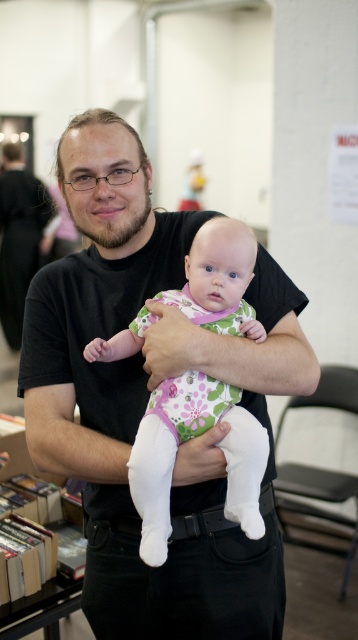
Question: Which of the following is the closest to the observer?

Choices:
 (A) (45, 531)
 (B) (220, 541)

Answer: (B)

Question: Which of these objects is positioned farthest from the floral cotton onesie at center?

Choices:
 (A) hardcover books at left
 (B) black matte shirt at center

Answer: (A)

Question: Which object is closer to the camera taking this photo?

Choices:
 (A) hardcover books at left
 (B) black matte shirt at center

Answer: (B)

Question: Is floral cotton onesie at center thinner than hardcover books at left?

Choices:
 (A) yes
 (B) no

Answer: (A)

Question: Can you confirm if black matte shirt at center is positioned below hardcover books at left?

Choices:
 (A) no
 (B) yes

Answer: (A)

Question: Is black matte shirt at center to the left of floral cotton onesie at center from the viewer's perspective?

Choices:
 (A) yes
 (B) no

Answer: (A)